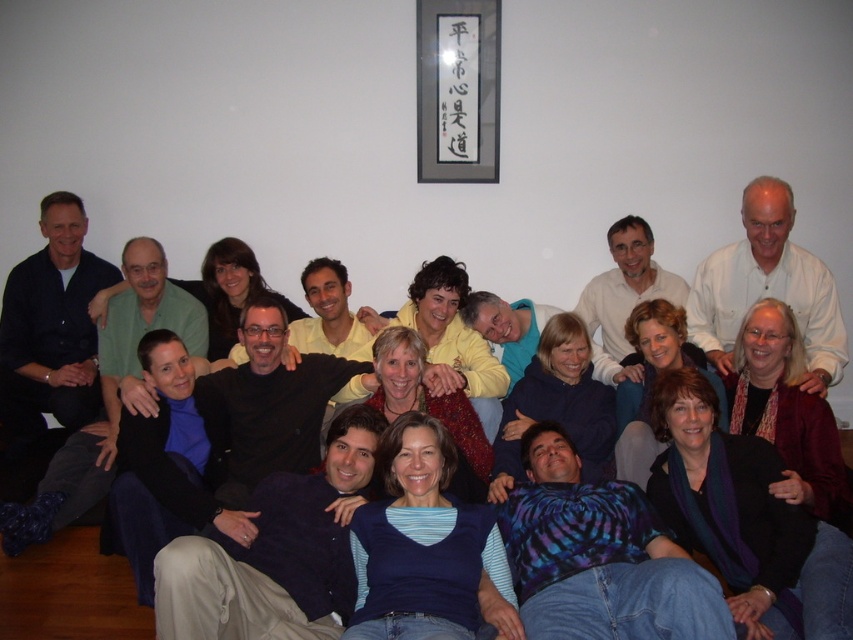
Question: Which object is closer to the camera taking this photo?

Choices:
 (A) matte black jacket at center
 (B) dark blue shirt at left
 (C) white matte shirt at upper right

Answer: (C)

Question: Which is farther from the white matte shirt at upper right?

Choices:
 (A) matte black jacket at center
 (B) dark blue shirt at left

Answer: (B)

Question: Among these points, which one is nearest to the camera?

Choices:
 (A) (x=842, y=333)
 (B) (x=83, y=353)

Answer: (A)

Question: Where is matte black jacket at center located in relation to white matte shirt at upper right in the image?

Choices:
 (A) left
 (B) right

Answer: (A)

Question: Can you confirm if matte black jacket at center is positioned below dark blue shirt at left?

Choices:
 (A) no
 (B) yes

Answer: (B)

Question: Observing the image, what is the correct spatial positioning of dark blue shirt at left in reference to white matte shirt at upper right?

Choices:
 (A) below
 (B) above

Answer: (A)